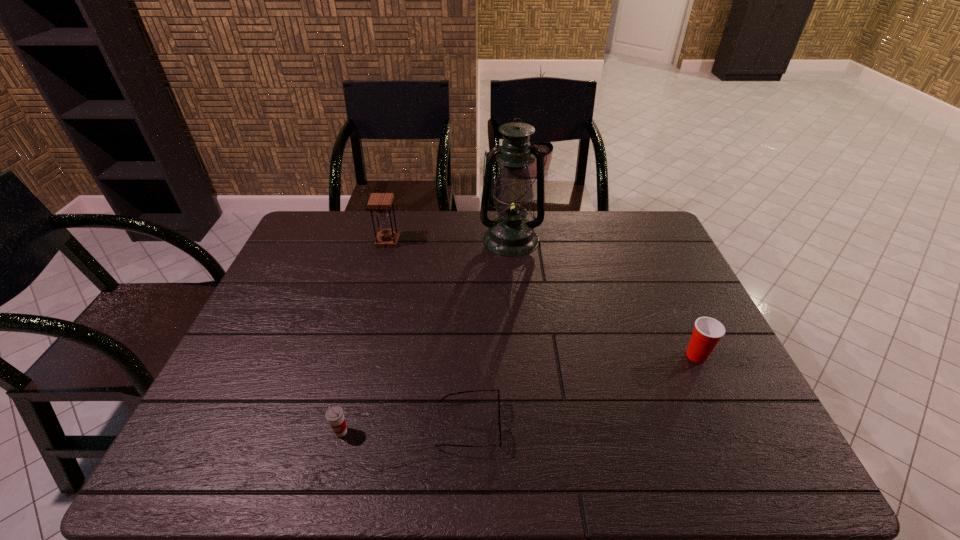
Where is `free point between the Dixie cup and the fourth shortest object`? The width and height of the screenshot is (960, 540). free point between the Dixie cup and the fourth shortest object is located at coordinates (542, 299).

Where is `vacant space that is in between the cup and the third farthest object`? This screenshot has width=960, height=540. vacant space that is in between the cup and the third farthest object is located at coordinates (518, 394).

Where is `free space between the cup and the third farthest object`? The height and width of the screenshot is (540, 960). free space between the cup and the third farthest object is located at coordinates (518, 394).

Image resolution: width=960 pixels, height=540 pixels. In order to click on the third closest object relative to the oil lamp in this screenshot , I will do `click(499, 422)`.

Identify which object is the fourth closest to the cup. Please provide its 2D coordinates. Your answer should be formatted as a tuple, i.e. [(x, y)], where the tuple contains the x and y coordinates of a point satisfying the conditions above.

[(708, 331)]

This screenshot has height=540, width=960. I want to click on free space that satisfies the following two spatial constraints: 1. on the front side of the fourth shortest object; 2. on the left side of the third nearest object, so point(357,355).

At what (x,y) coordinates should I click in order to perform the action: click on free region that satisfies the following two spatial constraints: 1. on the front side of the rightmost object; 2. on the right side of the fourth shortest object. Please return your answer as a coordinate pair (x, y). This screenshot has width=960, height=540. Looking at the image, I should click on (357, 355).